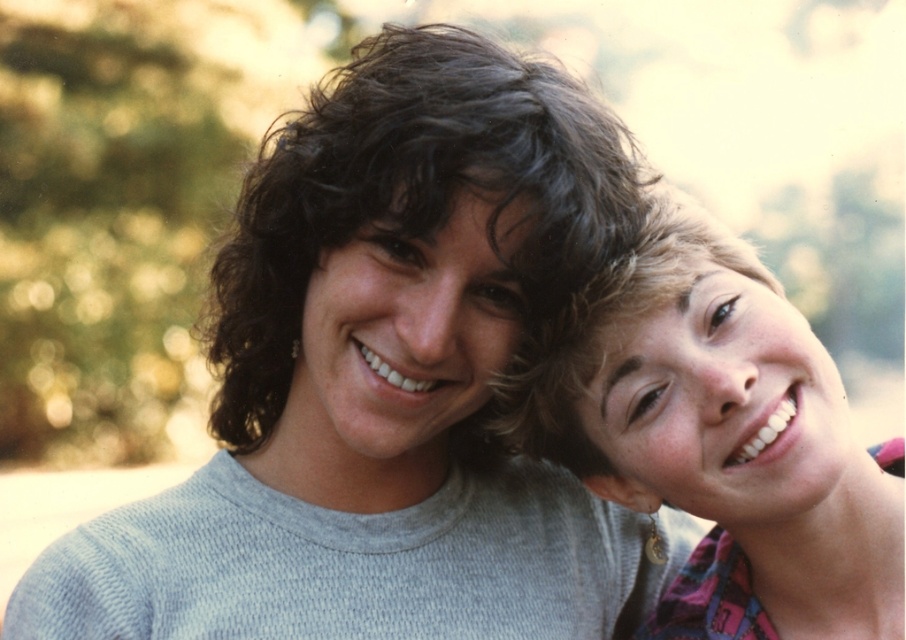
Question: Which point is closer to the camera taking this photo?

Choices:
 (A) (608, 344)
 (B) (567, 83)
 (C) (627, 452)

Answer: (B)

Question: Is matte pink scarf at right bigger than dark curly hair at center?

Choices:
 (A) yes
 (B) no

Answer: (B)

Question: Observing the image, what is the correct spatial positioning of dark curly hair at center in reference to blonde curly hair at upper right?

Choices:
 (A) right
 (B) left

Answer: (B)

Question: Does dark curly hair at center have a greater width compared to blonde curly hair at upper right?

Choices:
 (A) yes
 (B) no

Answer: (A)

Question: Which point is closer to the camera?

Choices:
 (A) (767, 404)
 (B) (519, 371)
 (C) (297, 280)

Answer: (A)

Question: Which object is closer to the camera taking this photo?

Choices:
 (A) blonde curly hair at upper right
 (B) matte pink scarf at right

Answer: (A)